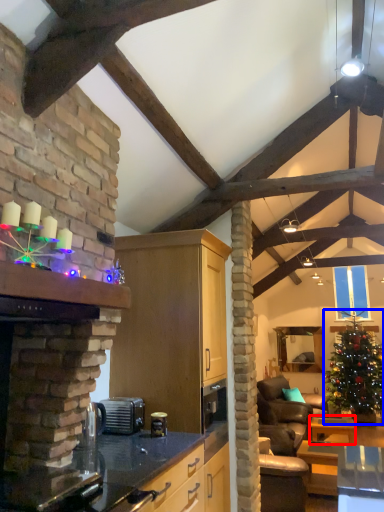
Question: Which of the following is the farthest to the observer, table (highlighted by a red box) or christmas tree (highlighted by a blue box)?

Choices:
 (A) table
 (B) christmas tree

Answer: (B)